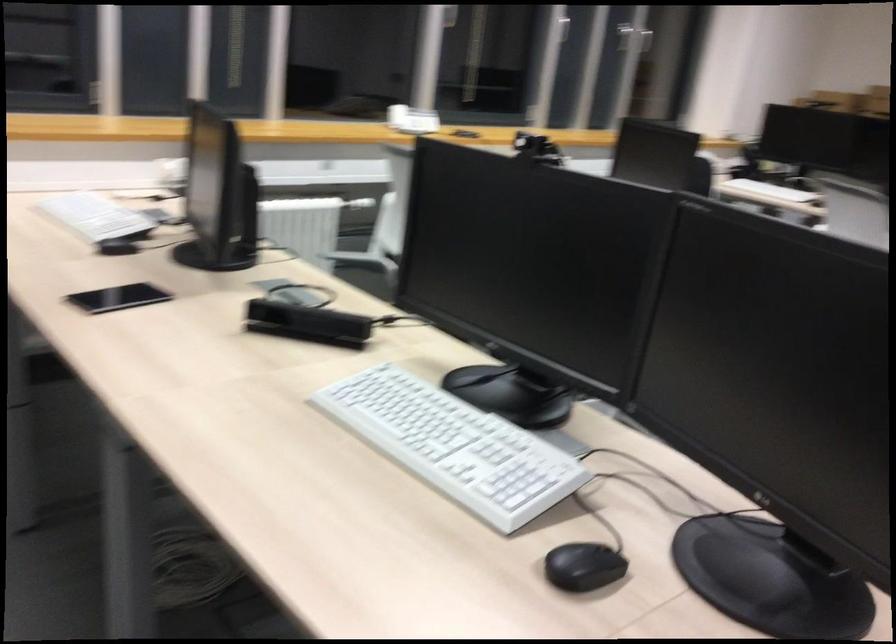
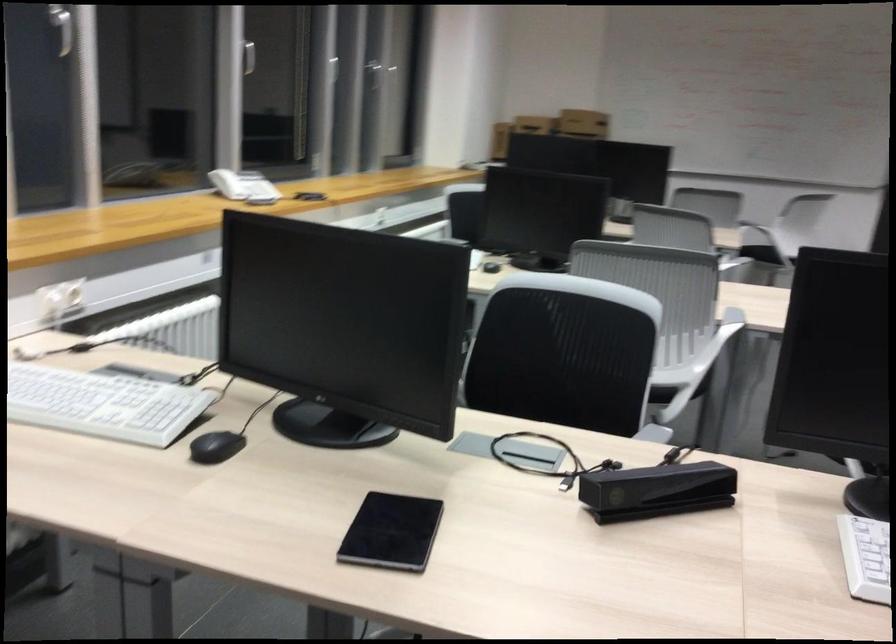
Find the pixel in the second image that matches point 110,249 in the first image.

(216, 447)